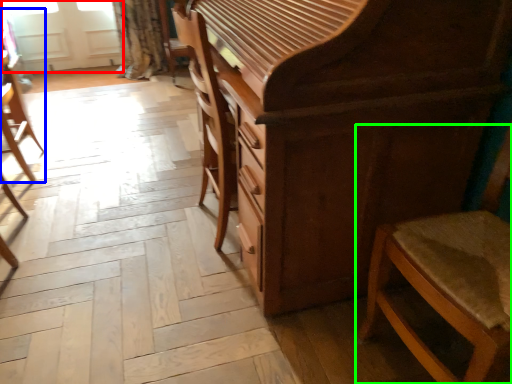
Question: Which object is the farthest from screen door (highlighted by a red box)? Choose among these: chair (highlighted by a blue box) or chair (highlighted by a green box).

Choices:
 (A) chair
 (B) chair

Answer: (B)